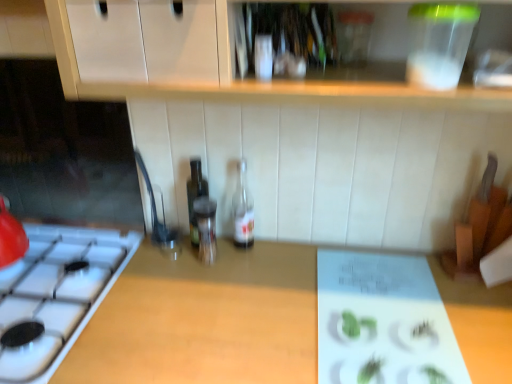
Image resolution: width=512 pixels, height=384 pixels. Identify the location of unoccupied region to the right of translucent glass bottle at center, the third bottle in the right-to-left sequence. (260, 258).